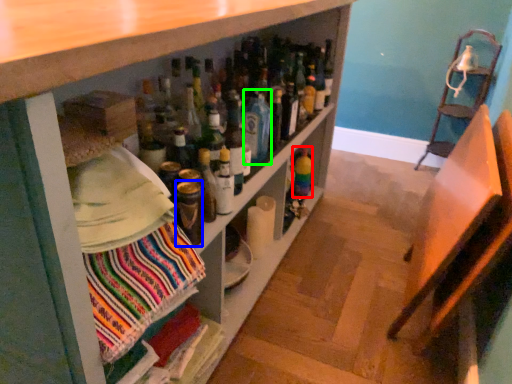
Question: Which is nearer to the bottle (highlighted by a red box)? bottle (highlighted by a blue box) or beverage (highlighted by a green box).

Choices:
 (A) bottle
 (B) beverage

Answer: (B)